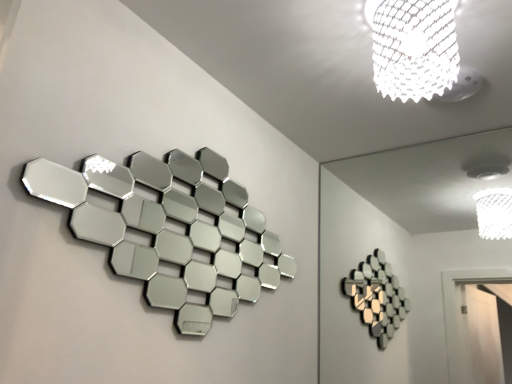
What is the approximate height of white textured lampshade at upper right?

It is 9.01 inches.

Image resolution: width=512 pixels, height=384 pixels. What do you see at coordinates (413, 47) in the screenshot? I see `white textured lampshade at upper right` at bounding box center [413, 47].

Locate an element on the screen. white textured lampshade at upper right is located at coordinates (413, 47).

Locate an element on the screen. white textured lampshade at upper right is located at coordinates (413, 47).